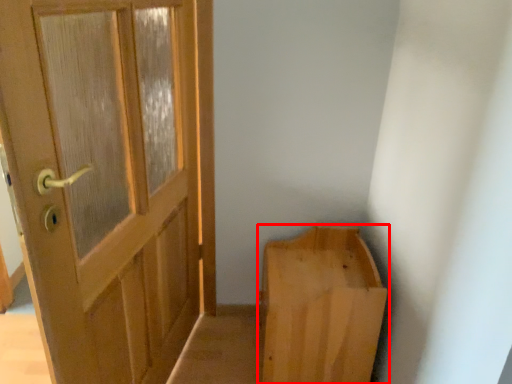
Question: From the image's perspective, where is furniture (annotated by the red box) located in relation to door in the image?

Choices:
 (A) below
 (B) above

Answer: (A)